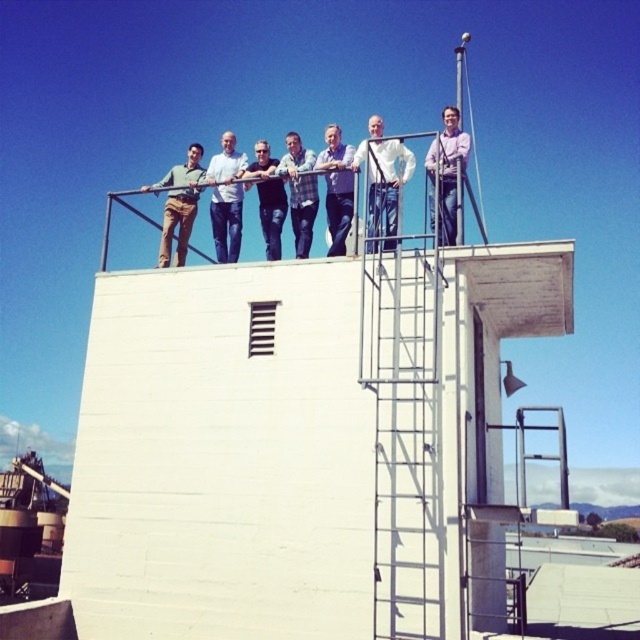
Question: Among these objects, which one is farthest from the camera?

Choices:
 (A) matte khaki pants at upper left
 (B) light blue jeans at center

Answer: (A)

Question: Which point is farther from the camera taking this photo?

Choices:
 (A) (429, 216)
 (B) (216, 180)

Answer: (B)

Question: Can you confirm if matte khaki pants at upper left is positioned to the right of denim jeans at center?

Choices:
 (A) no
 (B) yes

Answer: (A)

Question: Which point appears closest to the camera in this image?

Choices:
 (A) (227, 246)
 (B) (280, 204)

Answer: (B)

Question: Can you confirm if matte khaki pants at upper left is positioned above denim jeans at center?

Choices:
 (A) yes
 (B) no

Answer: (A)

Question: Is light blue jeans at center smaller than matte khaki pants at upper left?

Choices:
 (A) yes
 (B) no

Answer: (A)